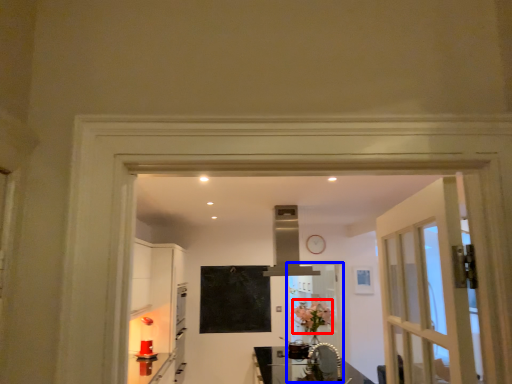
Question: Which object appears closest to the camera in this image, flower (highlighted by a red box) or screen door (highlighted by a blue box)?

Choices:
 (A) flower
 (B) screen door

Answer: (A)